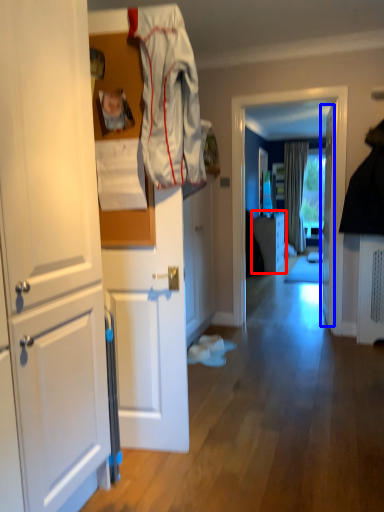
Question: Among these objects, which one is nearest to the camera, cabinetry (highlighted by a red box) or door (highlighted by a blue box)?

Choices:
 (A) cabinetry
 (B) door

Answer: (B)